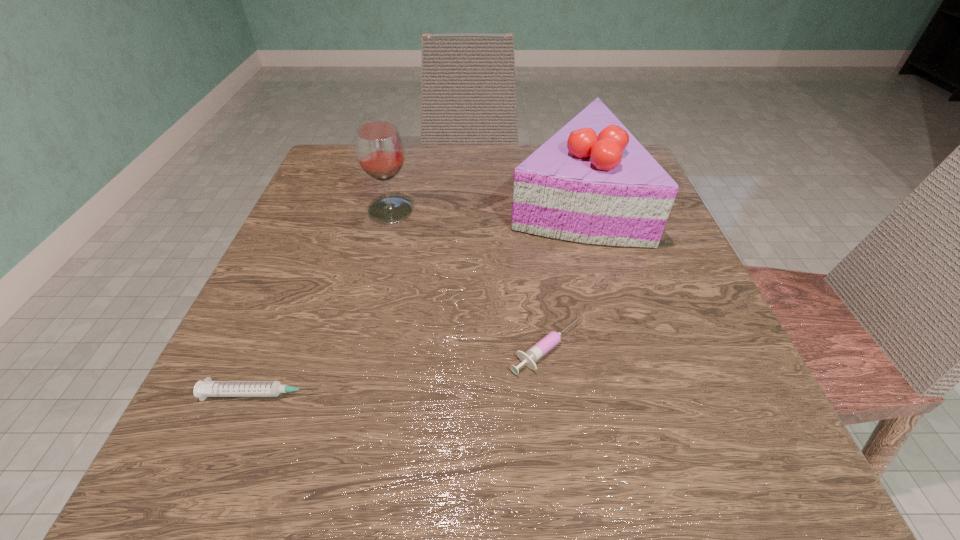
You are a GUI agent. You are given a task and a screenshot of the screen. Output one action in this format:
    pyautogui.click(x=<x>, y=<y>)
    Task: Click on the free space between the farther syringe and the cake
    The width and height of the screenshot is (960, 540).
    Given the screenshot: What is the action you would take?
    pyautogui.click(x=559, y=271)

Image resolution: width=960 pixels, height=540 pixels. I want to click on free space between the right syringe and the cake, so click(x=559, y=271).

The image size is (960, 540). In order to click on vacant region between the right syringe and the wineglass in this screenshot , I will do `click(468, 280)`.

Image resolution: width=960 pixels, height=540 pixels. Identify the location of vacant region between the wineglass and the second nearest object. 468,280.

Identify which object is located as the second nearest to the cake. Please provide its 2D coordinates. Your answer should be formatted as a tuple, i.e. [(x, y)], where the tuple contains the x and y coordinates of a point satisfying the conditions above.

[(379, 148)]

Locate which object ranks second in proximity to the wineglass. Please provide its 2D coordinates. Your answer should be formatted as a tuple, i.e. [(x, y)], where the tuple contains the x and y coordinates of a point satisfying the conditions above.

[(528, 358)]

The image size is (960, 540). What are the coordinates of `free location that satisfies the following two spatial constraints: 1. on the back side of the wineglass; 2. on the right side of the cake` in the screenshot? It's located at (395, 194).

The height and width of the screenshot is (540, 960). I want to click on free space in the image that satisfies the following two spatial constraints: 1. on the back side of the cake; 2. on the left side of the wineglass, so click(x=395, y=194).

At what (x,y) coordinates should I click in order to perform the action: click on vacant region that satisfies the following two spatial constraints: 1. on the back side of the farther syringe; 2. on the left side of the cake. Please return your answer as a coordinate pair (x, y). This screenshot has height=540, width=960. Looking at the image, I should click on (526, 194).